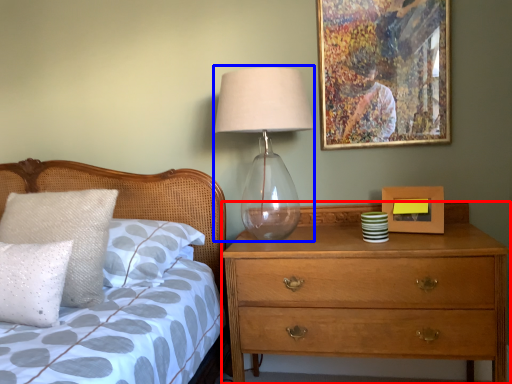
Question: Which object appears closest to the camera in this image, chest of drawers (highlighted by a red box) or table lamp (highlighted by a blue box)?

Choices:
 (A) chest of drawers
 (B) table lamp

Answer: (A)